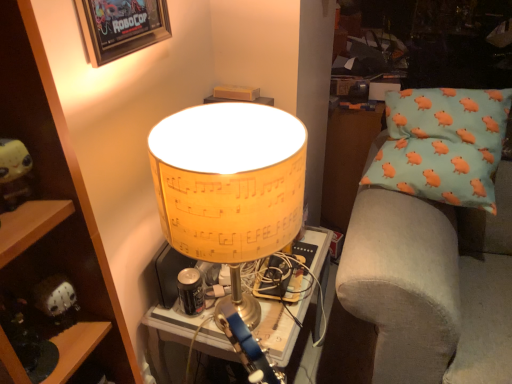
Question: Would you say yellow paper lampshade at center is to the left or to the right of wooden shelf at left in the picture?

Choices:
 (A) right
 (B) left

Answer: (A)

Question: Relative to wooden shelf at left, is yellow paper lampshade at center in front or behind?

Choices:
 (A) behind
 (B) front

Answer: (A)

Question: Based on their relative distances, which object is farther from the light blue fabric pillow with orange pig patterns at right?

Choices:
 (A) yellow plush toy at left
 (B) light blue fabric pillow with orange pig patterns at right
 (C) wooden shelf at left
 (D) yellow paper lampshade at center
 (E) yellow paper lampshade at center

Answer: (A)

Question: Which is nearer to the wooden shelf at left?

Choices:
 (A) wooden framed poster at upper left
 (B) light blue fabric pillow with orange pig patterns at right
 (C) yellow paper lampshade at center
 (D) yellow paper lampshade at center
 (E) light blue fabric pillow with orange pig patterns at right

Answer: (C)